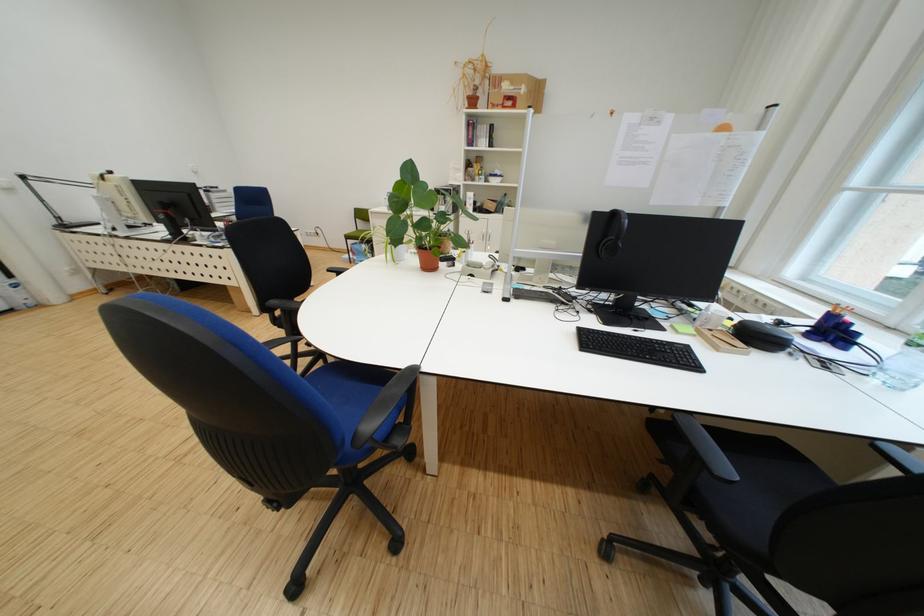
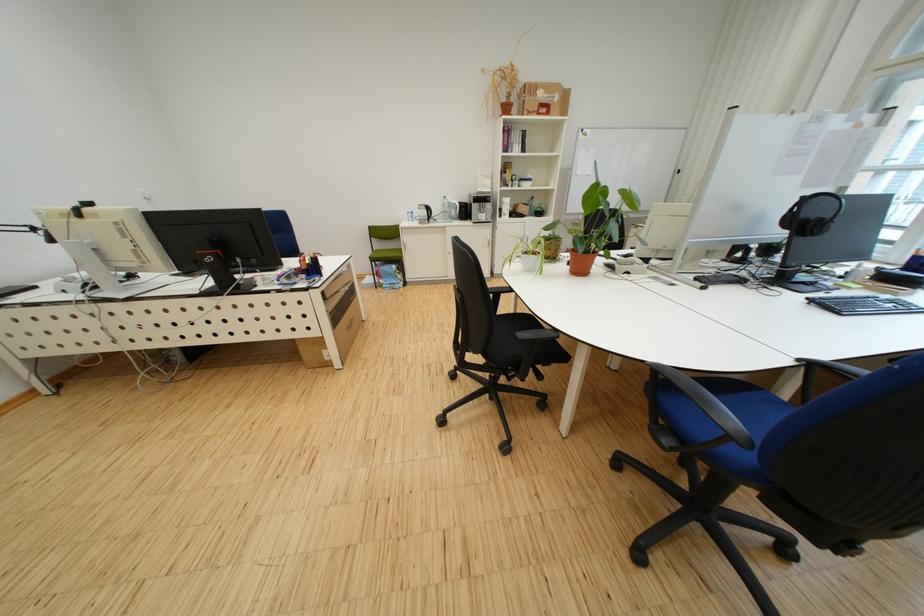
Find the pixel in the second image that matches [505,108] in the first image.

(541, 115)